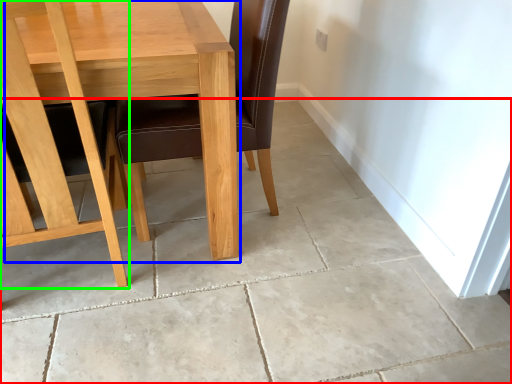
Question: Estimate the real-world distances between objects in this image. Which object is farther from concrete (highlighted by a red box), table (highlighted by a blue box) or chair (highlighted by a green box)?

Choices:
 (A) table
 (B) chair

Answer: (A)